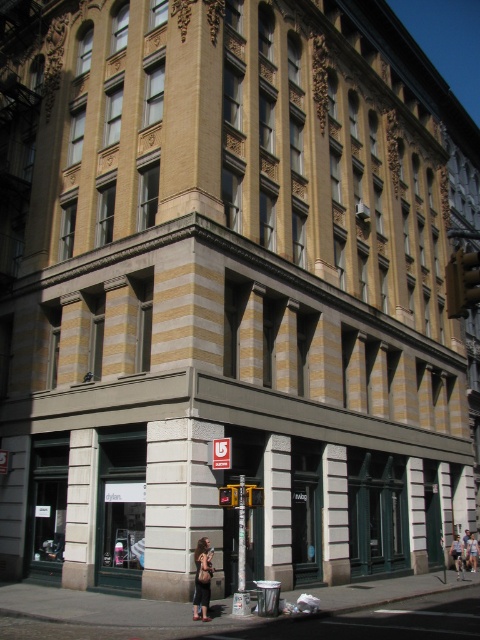
From the picture: Is dark brown leather jacket at lower center smaller than light brown leather jacket at center?

Incorrect, dark brown leather jacket at lower center is not smaller in size than light brown leather jacket at center.

Which is behind, point (206, 602) or point (471, 566)?

The point (471, 566) is behind.

Is point (197, 596) in front of point (478, 552)?

That is True.

Where is `dark brown leather jacket at lower center`? dark brown leather jacket at lower center is located at coordinates (202, 579).

Does white stone pillar at lower left appear under denim jacket at lower right?

No.

Is white stone pillar at lower left to the left of denim jacket at lower right from the viewer's perspective?

Indeed, white stone pillar at lower left is positioned on the left side of denim jacket at lower right.

Between point (74, 506) and point (454, 540), which one is positioned in front?

Point (74, 506) is more forward.

Find the location of a particular element. The image size is (480, 640). white stone pillar at lower left is located at coordinates (81, 509).

Between dark brown leather jacket at lower center and denim jacket at lower right, which one is positioned higher?

dark brown leather jacket at lower center

Is point (199, 560) positioned behind point (455, 566)?

No.

Is point (205, 580) positioned in front of point (460, 554)?

Yes.

Locate an element on the screen. dark brown leather jacket at lower center is located at coordinates (202, 579).